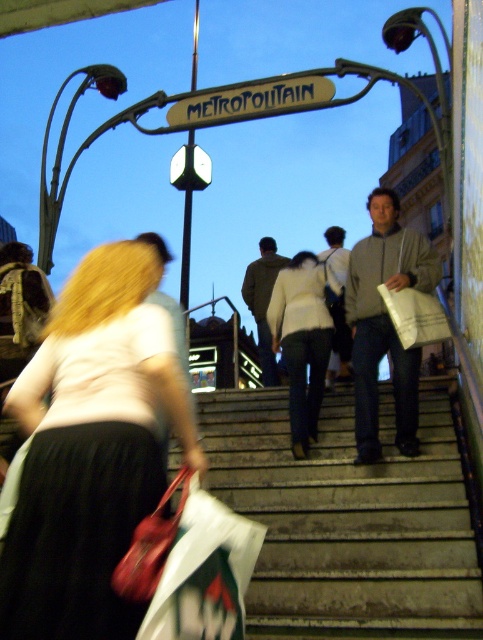
Question: Can you confirm if white matte jacket at center is positioned below metallic gold sign at upper center?

Choices:
 (A) no
 (B) yes

Answer: (B)

Question: Among these objects, which one is farthest from the camera?

Choices:
 (A) matte white blouse at lower left
 (B) white matte jacket at center
 (C) concrete stairs at center
 (D) metallic gold sign at upper center

Answer: (D)

Question: Which of these objects is positioned farthest from the white matte jacket at center?

Choices:
 (A) matte white blouse at lower left
 (B) concrete stairs at center
 (C) metallic gold sign at upper center

Answer: (C)

Question: Which point is farther to the camera?

Choices:
 (A) metallic gold sign at upper center
 (B) concrete stairs at center
 (C) matte white blouse at lower left
 (D) white matte jacket at center

Answer: (A)

Question: Does matte white blouse at lower left have a larger size compared to white matte jacket at center?

Choices:
 (A) yes
 (B) no

Answer: (A)

Question: Is the position of concrete stairs at center less distant than that of white matte jacket at center?

Choices:
 (A) no
 (B) yes

Answer: (B)